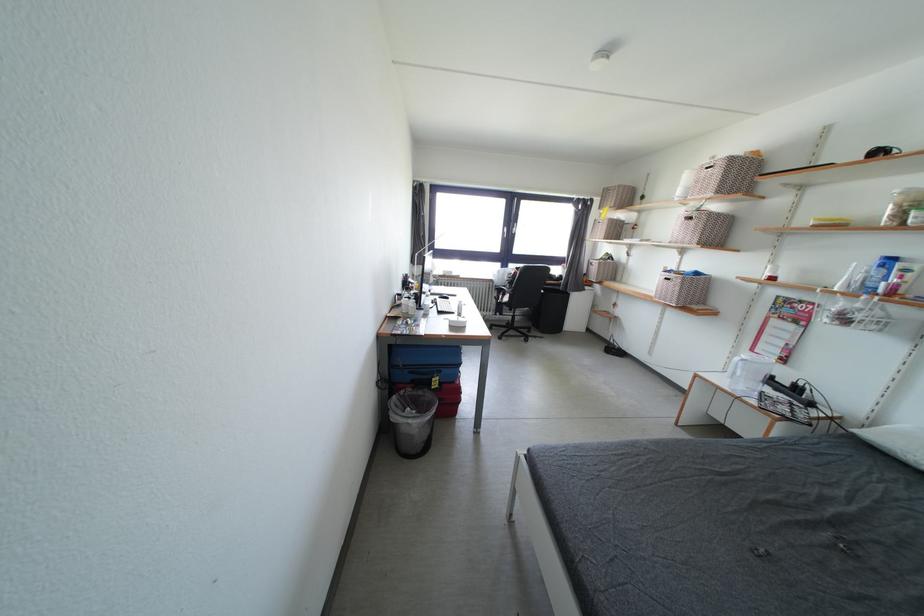
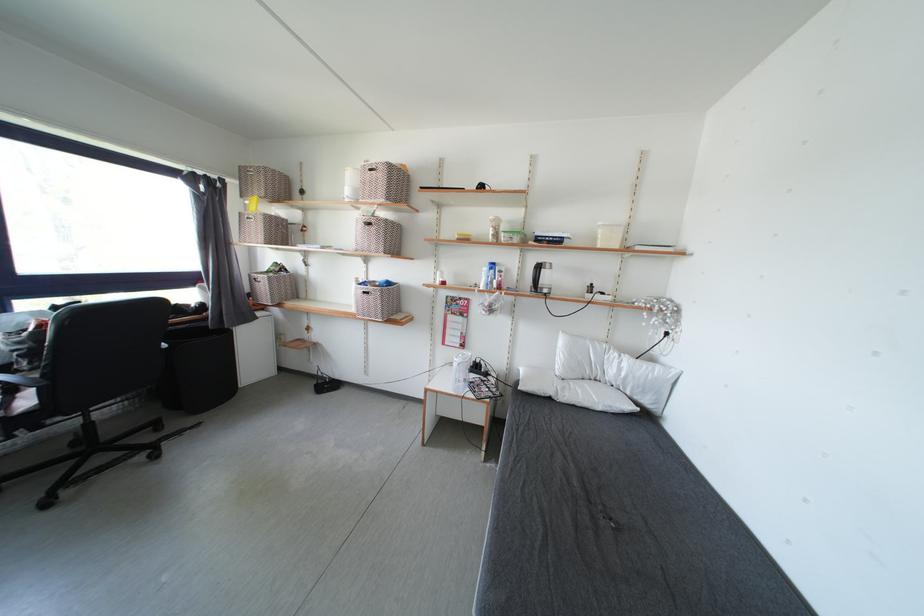
Where in the second image is the point corresponding to the point at 673,284 from the first image?

(371, 297)